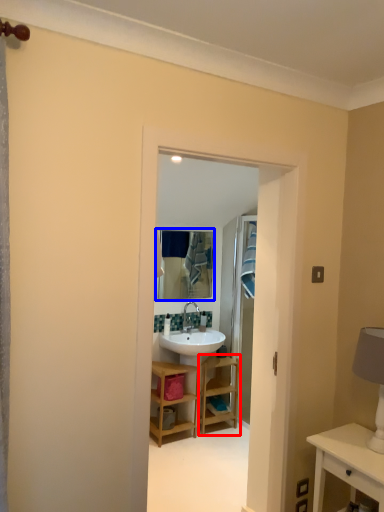
Question: Which object appears farthest to the camera in this image, shelf (highlighted by a red box) or mirror (highlighted by a blue box)?

Choices:
 (A) shelf
 (B) mirror

Answer: (B)